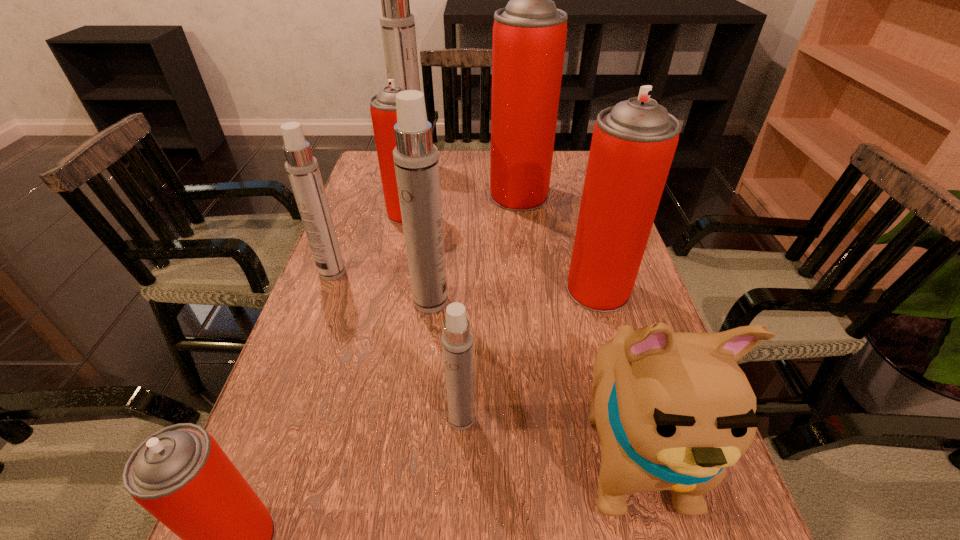
The width and height of the screenshot is (960, 540). I want to click on the seventh farthest aerosol can, so click(457, 339).

Find the location of a particular element. free region located on the left of the biggest red aerosol can is located at coordinates [x=472, y=195].

This screenshot has width=960, height=540. I want to click on vacant space located on the front of the second white aerosol can from left to right, so click(x=399, y=223).

Identify the location of blank area located on the right of the third white aerosol can from left to right. (585, 302).

Where is `blank area located 0.350m on the back of the third smallest red aerosol can`? This screenshot has height=540, width=960. blank area located 0.350m on the back of the third smallest red aerosol can is located at coordinates pos(570,192).

I want to click on vacant space positioned 0.050m on the front of the third red aerosol can from right to left, so click(x=403, y=237).

Where is `free spot located on the front of the second farthest white aerosol can`? This screenshot has height=540, width=960. free spot located on the front of the second farthest white aerosol can is located at coordinates (293, 380).

At what (x,y) coordinates should I click in order to perform the action: click on free point located 0.120m on the right of the nearest white aerosol can. Please return your answer as a coordinate pair (x, y). Looking at the image, I should click on (544, 418).

Find the location of a particular element. The height and width of the screenshot is (540, 960). object positioned at the right edge is located at coordinates (633, 144).

The width and height of the screenshot is (960, 540). Identify the location of object located in the far left corner section of the desktop. (397, 24).